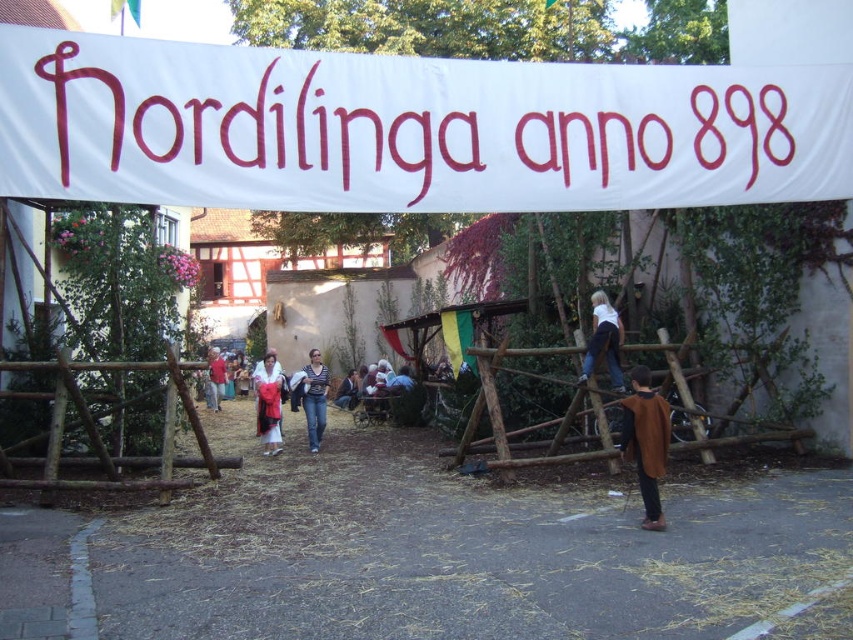
Question: Which object appears farthest from the camera in this image?

Choices:
 (A) white fabric banner at upper center
 (B) brown woolen cape at center
 (C) denim jeans at center

Answer: (C)

Question: Can you confirm if denim jeans at center is smaller than denim jacket at center?

Choices:
 (A) no
 (B) yes

Answer: (B)

Question: Estimate the real-world distances between objects in this image. Which object is farther from the brown woolen cape at center?

Choices:
 (A) white fabric banner at upper center
 (B) matte red dress at center
 (C) denim jacket at center

Answer: (C)

Question: Which of the following is the farthest from the observer?

Choices:
 (A) (631, 387)
 (B) (595, 333)

Answer: (A)

Question: Can you confirm if white fabric banner at upper center is positioned to the right of brown woolen cape at center?

Choices:
 (A) no
 (B) yes

Answer: (B)

Question: Is brown woolen cape at center positioned in front of matte red dress at center?

Choices:
 (A) yes
 (B) no

Answer: (A)